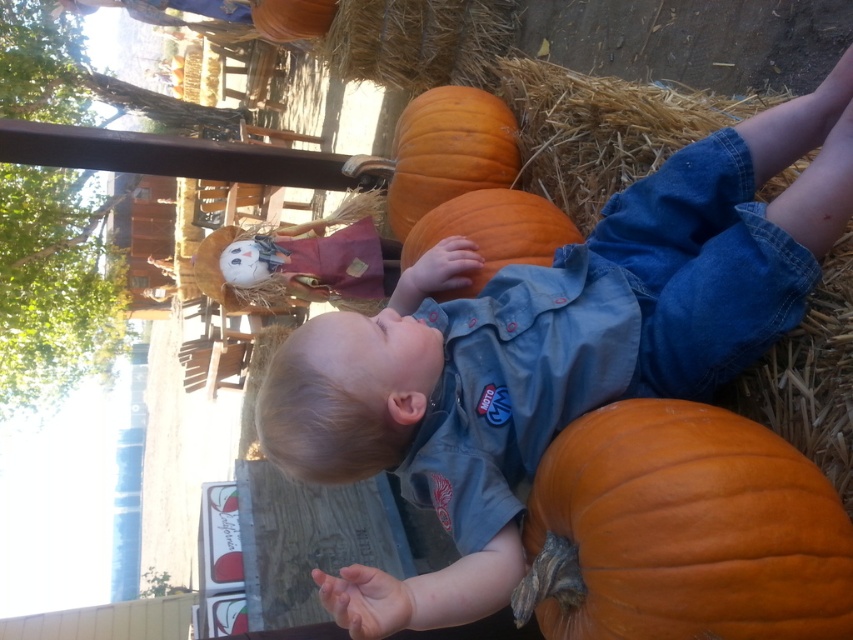
Between point (271, 369) and point (399, 189), which one is positioned behind?

Positioned behind is point (399, 189).

Locate an element on the screen. This screenshot has width=853, height=640. smooth denim shirt at center is located at coordinates pos(554,348).

Consider the image. Is smooth denim shirt at center smaller than orange matte pumpkin at center?

Actually, smooth denim shirt at center might be larger than orange matte pumpkin at center.

Who is positioned more to the right, smooth denim shirt at center or orange matte pumpkin at center?

Positioned to the right is smooth denim shirt at center.

What do you see at coordinates (554, 348) in the screenshot? The width and height of the screenshot is (853, 640). I see `smooth denim shirt at center` at bounding box center [554, 348].

Find the location of a particular element. This screenshot has width=853, height=640. smooth denim shirt at center is located at coordinates (554, 348).

From the picture: Who is shorter, orange matte pumpkin at lower right or orange matte pumpkin at center?

orange matte pumpkin at center is shorter.

Is point (527, 529) more distant than point (508, 252)?

No, (527, 529) is in front of (508, 252).

Between point (662, 547) and point (451, 221), which one is positioned behind?

Point (451, 221)

The height and width of the screenshot is (640, 853). Find the location of `orange matte pumpkin at lower right`. orange matte pumpkin at lower right is located at coordinates (682, 531).